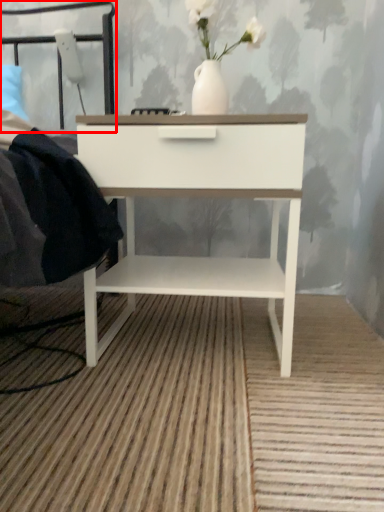
Question: From the image's perspective, what is the correct spatial relationship of headboard (annotated by the red box) in relation to nightstand?

Choices:
 (A) above
 (B) below

Answer: (A)